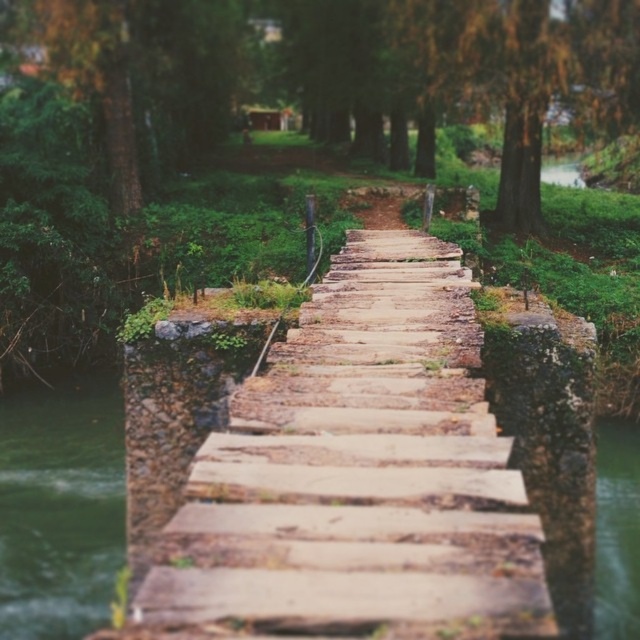
Question: Can you confirm if weathered wood path at center is positioned below green liquid at lower left?

Choices:
 (A) yes
 (B) no

Answer: (B)

Question: Is weathered wood path at center thinner than green liquid at lower left?

Choices:
 (A) yes
 (B) no

Answer: (A)

Question: Which of the following is the closest to the observer?

Choices:
 (A) weathered wood path at center
 (B) green liquid at lower left

Answer: (A)

Question: Can you confirm if weathered wood path at center is positioned to the right of green liquid at lower left?

Choices:
 (A) no
 (B) yes

Answer: (B)

Question: Which point is closer to the camera?

Choices:
 (A) (352, 579)
 (B) (122, 497)

Answer: (A)

Question: Among these points, which one is nearest to the camera?

Choices:
 (A) (502, 465)
 (B) (6, 620)

Answer: (A)